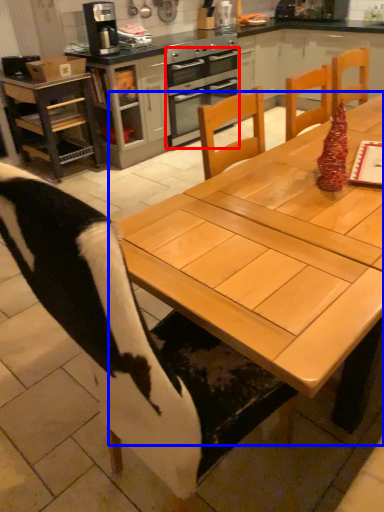
Question: Among these objects, which one is nearest to the camera, oven (highlighted by a red box) or table (highlighted by a blue box)?

Choices:
 (A) oven
 (B) table

Answer: (B)